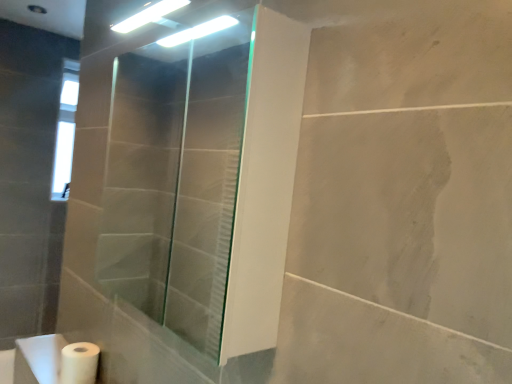
Question: Is there a large distance between transparent glass shower door at center and white matte sink at lower left?

Choices:
 (A) no
 (B) yes

Answer: (B)

Question: Can we say transparent glass shower door at center lies outside white matte sink at lower left?

Choices:
 (A) no
 (B) yes

Answer: (B)

Question: From the image's perspective, is transparent glass shower door at center on white matte sink at lower left?

Choices:
 (A) yes
 (B) no

Answer: (A)

Question: Does transparent glass shower door at center have a lesser height compared to white matte sink at lower left?

Choices:
 (A) no
 (B) yes

Answer: (A)

Question: Can you confirm if transparent glass shower door at center is positioned to the left of white matte sink at lower left?

Choices:
 (A) yes
 (B) no

Answer: (B)

Question: From the image's perspective, is white matte sink at lower left above or below white matte toilet paper at lower left?

Choices:
 (A) below
 (B) above

Answer: (A)

Question: Choose the correct answer: Is white matte sink at lower left inside white matte toilet paper at lower left or outside it?

Choices:
 (A) outside
 (B) inside

Answer: (A)

Question: Considering their positions, is white matte sink at lower left located in front of or behind white matte toilet paper at lower left?

Choices:
 (A) front
 (B) behind

Answer: (A)

Question: In terms of height, does white matte sink at lower left look taller or shorter compared to white matte toilet paper at lower left?

Choices:
 (A) tall
 (B) short

Answer: (B)

Question: Is white matte toilet paper at lower left bigger or smaller than transparent glass shower door at center?

Choices:
 (A) small
 (B) big

Answer: (A)

Question: Relative to transparent glass shower door at center, is white matte toilet paper at lower left in front or behind?

Choices:
 (A) front
 (B) behind

Answer: (B)

Question: From the image's perspective, is white matte toilet paper at lower left located above or below transparent glass shower door at center?

Choices:
 (A) above
 (B) below

Answer: (B)

Question: From a real-world perspective, is white matte toilet paper at lower left positioned above or below transparent glass shower door at center?

Choices:
 (A) below
 (B) above

Answer: (A)

Question: Choose the correct answer: Is transparent glass shower door at center inside white matte toilet paper at lower left or outside it?

Choices:
 (A) inside
 (B) outside

Answer: (B)

Question: From a real-world perspective, is transparent glass shower door at center positioned above or below white matte toilet paper at lower left?

Choices:
 (A) below
 (B) above

Answer: (B)